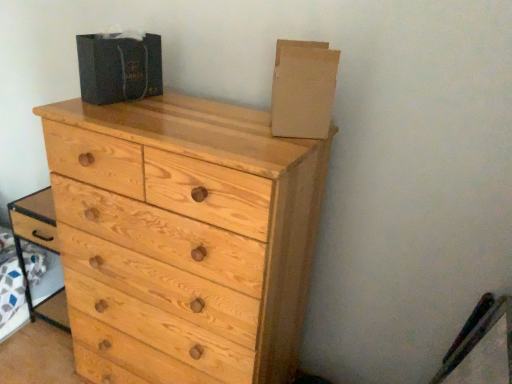
Locate an element on the screen. vacant region to the left of cardboard at upper right, which is counted as the 1th cardboard box, starting from the right is located at coordinates (233, 121).